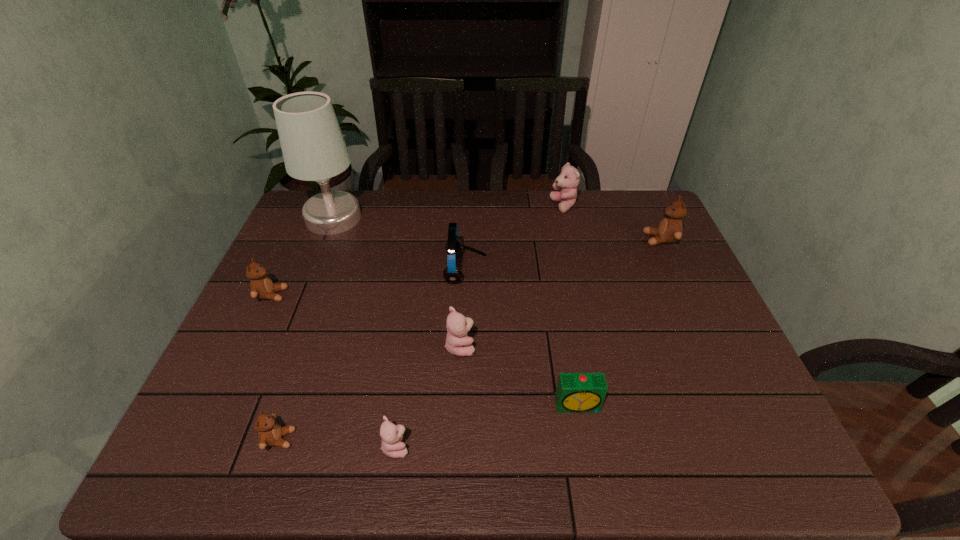
Identify which object is located as the second nearest to the nearest pink teddy bear. Please provide its 2D coordinates. Your answer should be formatted as a tuple, i.e. [(x, y)], where the tuple contains the x and y coordinates of a point satisfying the conditions above.

[(458, 343)]

The width and height of the screenshot is (960, 540). I want to click on teddy bear that is the sixth closest to the alarm clock, so click(x=261, y=286).

You are a GUI agent. You are given a task and a screenshot of the screen. Output one action in this format:
    pyautogui.click(x=<x>, y=<y>)
    Task: Click on the closest teddy bear to the gray lampshade
    The height and width of the screenshot is (540, 960).
    Given the screenshot: What is the action you would take?
    pyautogui.click(x=261, y=286)

Point out which pink teddy bear is positioned as the third nearest to the alarm clock. Please provide its 2D coordinates. Your answer should be formatted as a tuple, i.e. [(x, y)], where the tuple contains the x and y coordinates of a point satisfying the conditions above.

[(568, 180)]

The height and width of the screenshot is (540, 960). Identify the location of pink teddy bear that stands as the closest to the farthest pink teddy bear. (458, 343).

At what (x,y) coordinates should I click in order to perform the action: click on brown teddy bear identified as the second closest to the second biggest brown teddy bear. Please return your answer as a coordinate pair (x, y). The image size is (960, 540). Looking at the image, I should click on (670, 229).

The image size is (960, 540). I want to click on brown teddy bear that stands as the third closest to the red headset, so click(670, 229).